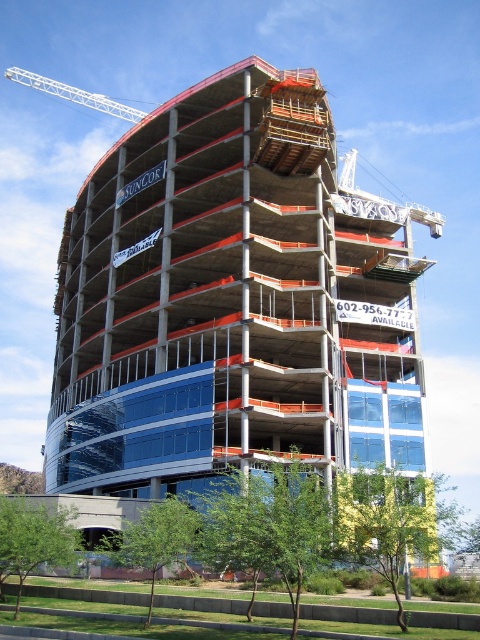
Does concrete building at center have a greater width compared to white metal crane at upper left?

Yes.

Which is behind, point (360, 323) or point (120, 108)?

Positioned behind is point (120, 108).

Does point (140, 200) come closer to viewer compared to point (139, 120)?

Yes.

Where is `concrete building at center`? concrete building at center is located at coordinates (231, 300).